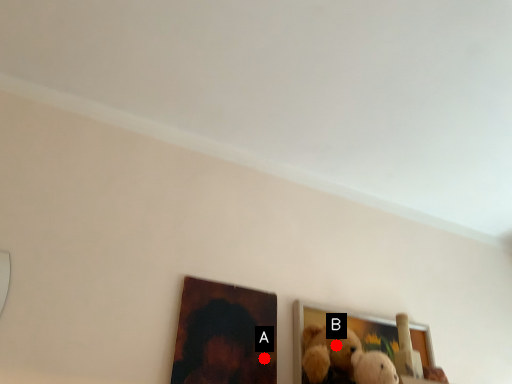
Question: Two points are circled on the image, labeled by A and B beside each circle. Which point appears closest to the camera in this image?

Choices:
 (A) A is closer
 (B) B is closer

Answer: (B)